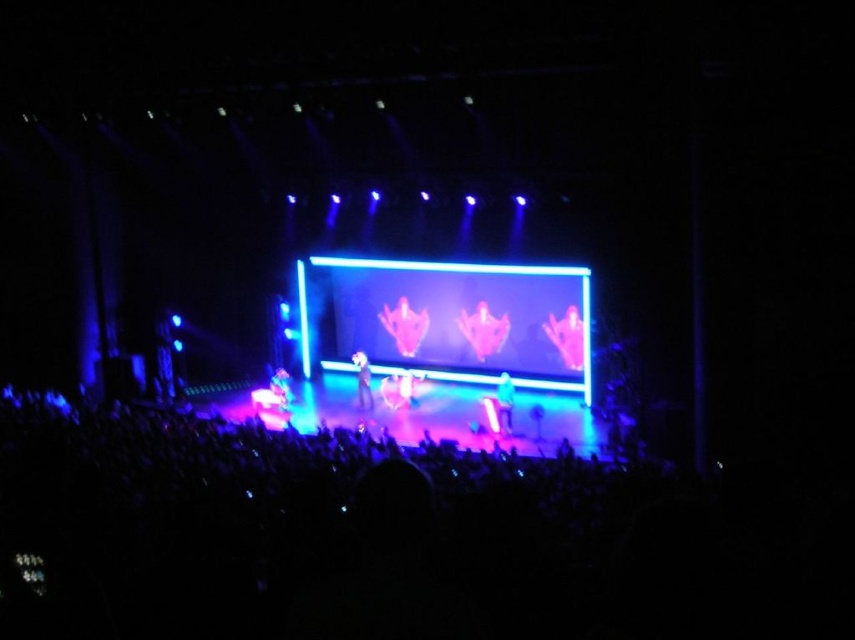
You are a photographer at the concert and want to capture the translucent pink figure at center without the neon pink fabric at center appearing in the background. Is this possible based on the scene description?

The neon pink fabric at center is behind the translucent pink figure at center, so it would still be visible through the translucent figure. Therefore, it is not possible to capture the translucent pink figure at center without the neon pink fabric at center appearing in the background.

You are a photographer at the concert. You want to capture a photo that includes both the translucent pink figure at center and the neon pink fabric at center. Which object should you focus on first to ensure both are in frame?

The translucent pink figure at center is taller than the neon pink fabric at center. Therefore, focus on the translucent pink figure at center first to ensure both fit within the frame.